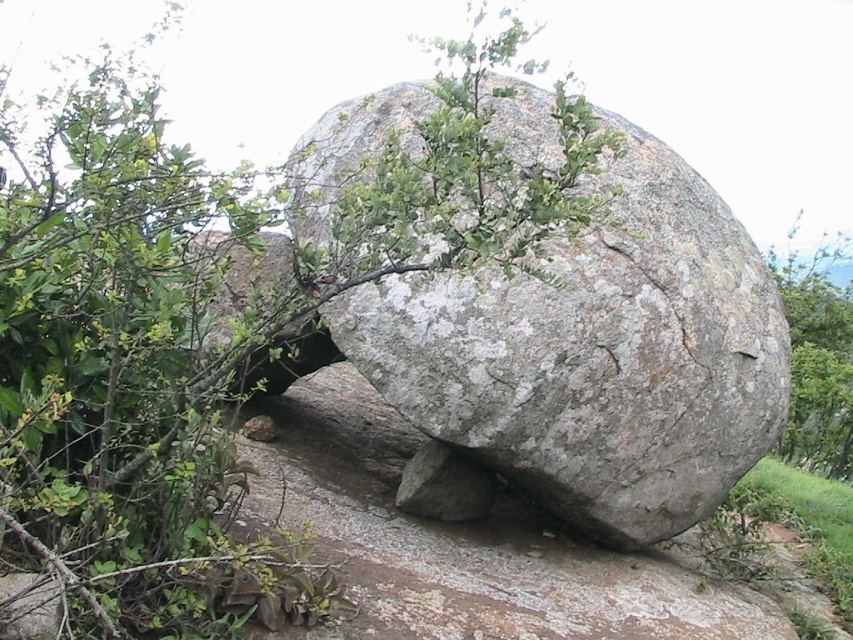
Between point (252, 561) and point (347, 164), which one is positioned in front?

Point (252, 561) is in front.

Does point (186, 579) come behind point (408, 378)?

No.

Locate an element on the screen. green leafy tree at center is located at coordinates (204, 314).

Is the position of green leafy tree at center more distant than that of green leafy tree at right?

No, green leafy tree at center is in front of green leafy tree at right.

Consider the image. Is the position of green leafy tree at center less distant than that of green leafy tree at right?

Yes, it is.

Identify the location of green leafy tree at center. This screenshot has height=640, width=853. (204, 314).

Between gray rough boulder at center and green leafy tree at right, which one appears on the left side from the viewer's perspective?

Positioned to the left is gray rough boulder at center.

Is point (519, 285) farther from viewer compared to point (798, 387)?

No.

Where is `gray rough boulder at center`? This screenshot has width=853, height=640. gray rough boulder at center is located at coordinates (596, 355).

Where is `gray rough boulder at center`? The image size is (853, 640). gray rough boulder at center is located at coordinates (596, 355).